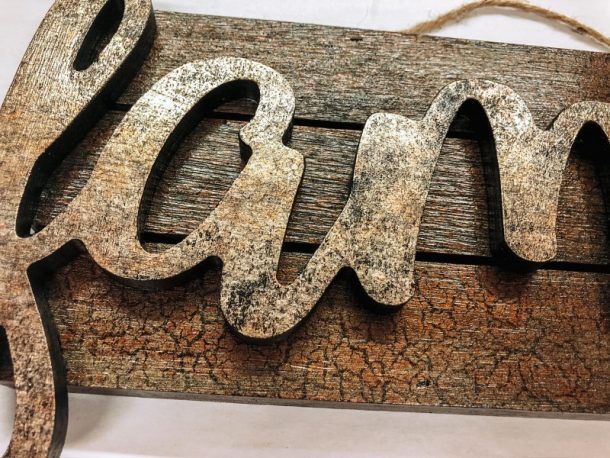
Locate an element on the screen. The image size is (610, 458). dark wood is located at coordinates (440, 320).